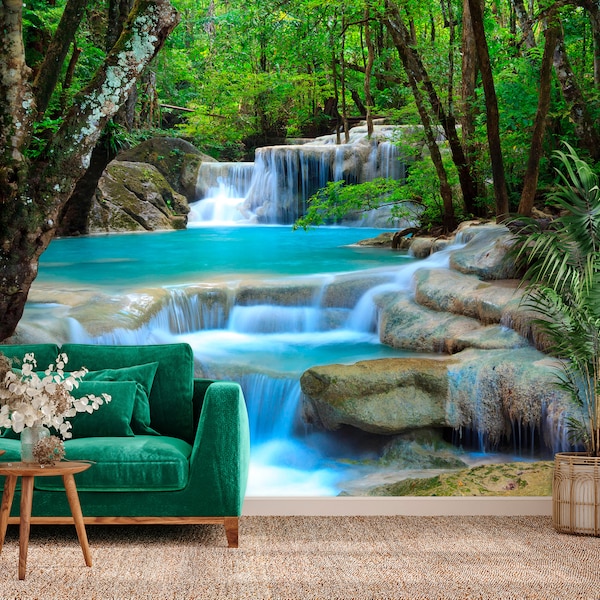
At what (x,y) coordinates should I click in order to perform the action: click on stool. Please return your answer as a coordinate pair (x, y). Image resolution: width=600 pixels, height=600 pixels. Looking at the image, I should click on (36, 475).